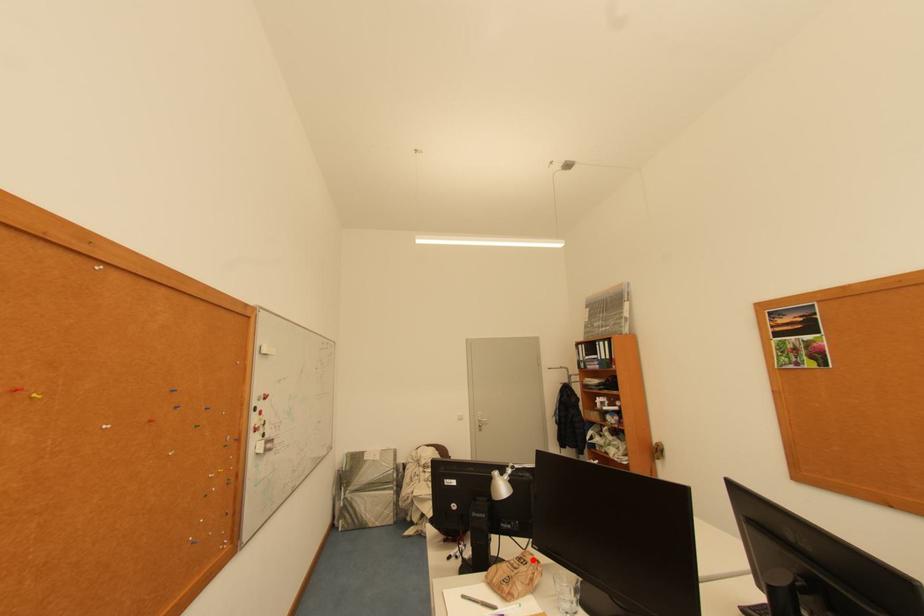
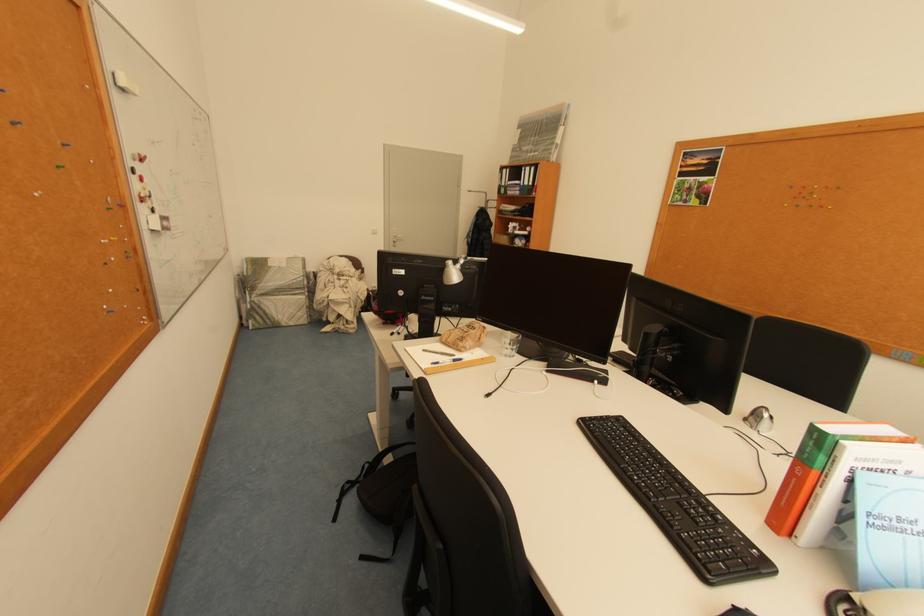
Locate, in the second image, the point that corresponds to the highlighted location in the first image.

(481, 328)